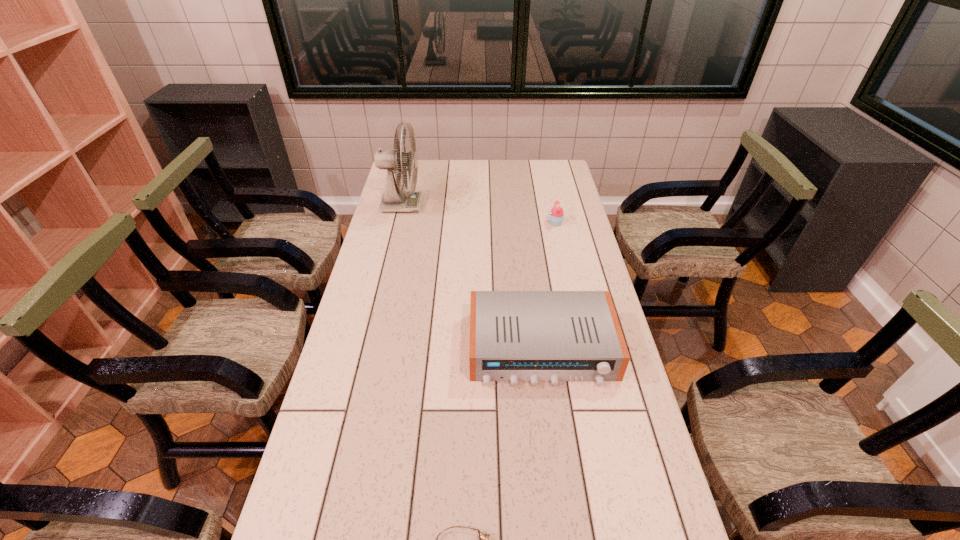
Identify the location of free space between the radio receiver and the cupcake. The width and height of the screenshot is (960, 540). (549, 286).

Identify the location of free area in between the leftmost object and the cupcake. (479, 214).

Find the location of a particular element. object that is the third closest one to the shortest object is located at coordinates (393, 200).

Locate an element on the screen. Image resolution: width=960 pixels, height=540 pixels. object that is the second closest to the radio receiver is located at coordinates tap(556, 217).

The height and width of the screenshot is (540, 960). In order to click on vacant space that satisfies the following two spatial constraints: 1. on the face of the cupcake; 2. on the control panel of the second nearest object in this screenshot , I will do `click(584, 348)`.

At what (x,y) coordinates should I click in order to perform the action: click on free point that satisfies the following two spatial constraints: 1. on the face of the cupcake; 2. on the control panel of the third farthest object. Please return your answer as a coordinate pair (x, y). The width and height of the screenshot is (960, 540). Looking at the image, I should click on (584, 348).